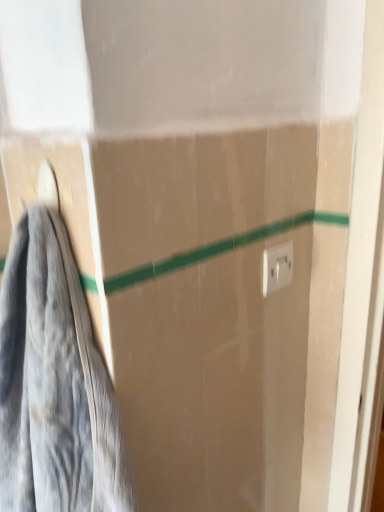
Question: Considering the positions of gray fabric towel at left and white plastic electric outlet at upper right in the image, is gray fabric towel at left wider or thinner than white plastic electric outlet at upper right?

Choices:
 (A) wide
 (B) thin

Answer: (A)

Question: Does point (18, 316) appear closer or farther from the camera than point (281, 245)?

Choices:
 (A) closer
 (B) farther

Answer: (A)

Question: Considering the positions of gray fabric towel at left and white plastic electric outlet at upper right in the image, is gray fabric towel at left taller or shorter than white plastic electric outlet at upper right?

Choices:
 (A) tall
 (B) short

Answer: (A)

Question: Considering the relative positions of white plastic electric outlet at upper right and gray fabric towel at left in the image provided, is white plastic electric outlet at upper right to the left or to the right of gray fabric towel at left?

Choices:
 (A) right
 (B) left

Answer: (A)

Question: From the image's perspective, is white plastic electric outlet at upper right positioned above or below gray fabric towel at left?

Choices:
 (A) above
 (B) below

Answer: (A)

Question: Is white plastic electric outlet at upper right bigger or smaller than gray fabric towel at left?

Choices:
 (A) small
 (B) big

Answer: (A)

Question: In terms of height, does white plastic electric outlet at upper right look taller or shorter compared to gray fabric towel at left?

Choices:
 (A) short
 (B) tall

Answer: (A)